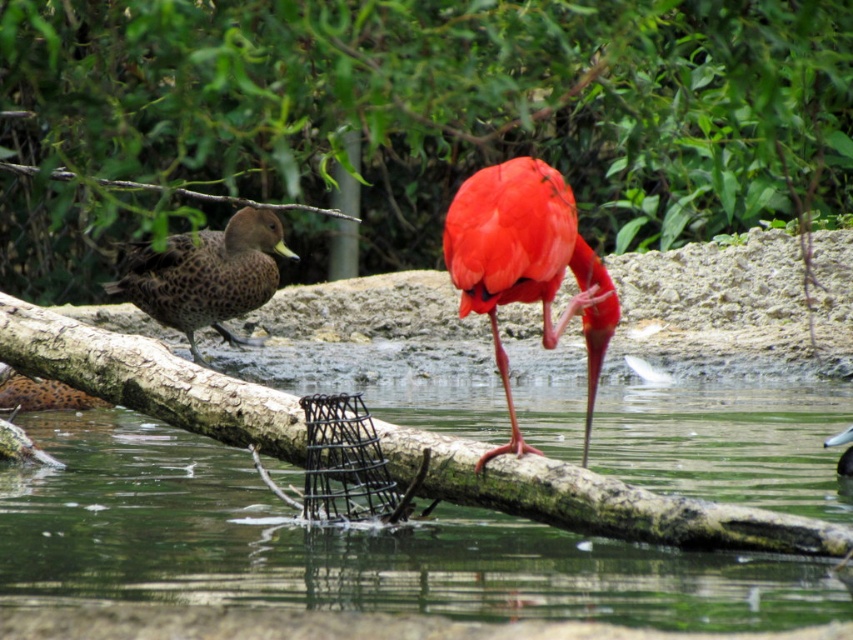
Based on the photo, who is more distant from viewer, (598, 259) or (155, 268)?

The point (155, 268) is more distant.

The width and height of the screenshot is (853, 640). Identify the location of bright red feathered bird at center. (526, 264).

Does brown speckled duck at left have a larger size compared to brown speckled duck at upper left?

Correct, brown speckled duck at left is larger in size than brown speckled duck at upper left.

Which of these two, brown speckled duck at left or brown speckled duck at upper left, stands taller?

With more height is brown speckled duck at left.

Which is in front, point (24, 392) or point (840, 442)?

Positioned in front is point (840, 442).

Identify the location of brown speckled duck at left. (39, 394).

Is green leafy tree at upper center bigger than brown speckled duck at upper left?

Indeed, green leafy tree at upper center has a larger size compared to brown speckled duck at upper left.

Which is in front, point (834, 138) or point (850, 429)?

Point (850, 429) is more forward.

What do you see at coordinates (447, 104) in the screenshot? I see `green leafy tree at upper center` at bounding box center [447, 104].

I want to click on green leafy tree at upper center, so click(447, 104).